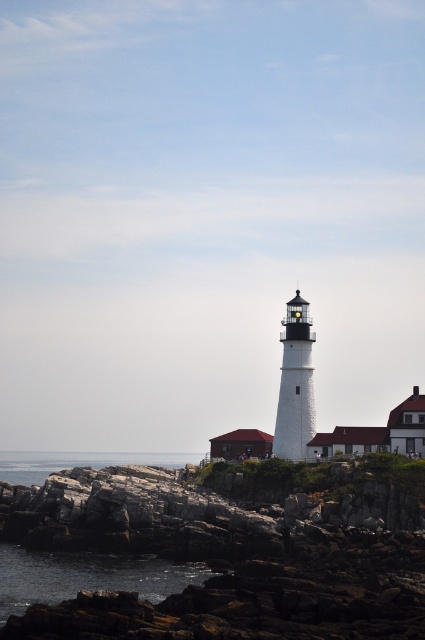
Does dark water at lower left have a lesser width compared to clear water at lower left?

Correct, dark water at lower left's width is less than clear water at lower left's.

Image resolution: width=425 pixels, height=640 pixels. Identify the location of dark water at lower left. (85, 577).

Which is in front, point (8, 560) or point (28, 461)?

Positioned in front is point (8, 560).

The image size is (425, 640). I want to click on dark water at lower left, so click(x=85, y=577).